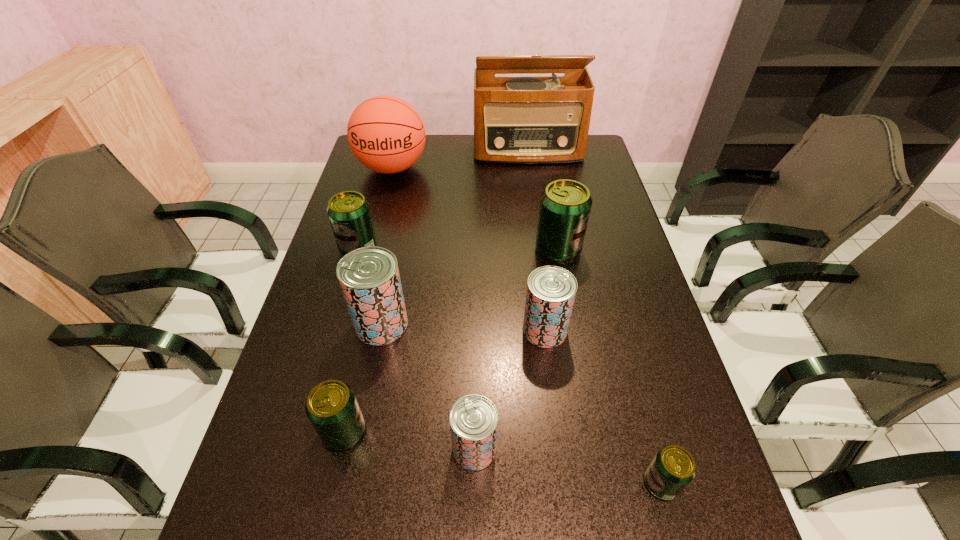
This screenshot has height=540, width=960. Identify the location of empty space between the third biggest green beer can and the shortest beer can. (503, 457).

This screenshot has width=960, height=540. What are the coordinates of `free space between the leftmost red beer can and the biggest green beer can` in the screenshot? It's located at (469, 287).

Locate an element on the screen. This screenshot has width=960, height=540. free space between the smallest red beer can and the third biggest green beer can is located at coordinates (409, 440).

Where is `free spot between the rightmost red beer can and the third biggest green beer can`? This screenshot has height=540, width=960. free spot between the rightmost red beer can and the third biggest green beer can is located at coordinates (444, 381).

The height and width of the screenshot is (540, 960). Find the location of `blank region between the rightmost beer can and the radio receiver`. blank region between the rightmost beer can and the radio receiver is located at coordinates (594, 316).

Identify the location of object that stands as the fifth closest to the biggest red beer can. (565, 205).

Find the location of a particular element. The image size is (960, 540). object that stands as the sixth closest to the nearest red beer can is located at coordinates pyautogui.click(x=349, y=213).

You are a GUI agent. You are given a task and a screenshot of the screen. Output one action in this format:
    pyautogui.click(x=<x>, y=<y>)
    Task: Click on the beer can identified as the third closest to the second red beer can from right to left
    The width and height of the screenshot is (960, 540).
    Given the screenshot: What is the action you would take?
    pos(369,278)

Where is `the sixth closest beer can to the leftmost red beer can`? The width and height of the screenshot is (960, 540). the sixth closest beer can to the leftmost red beer can is located at coordinates (672, 469).

Locate an element on the screen. The width and height of the screenshot is (960, 540). green beer can that can be found as the third closest to the biggest green beer can is located at coordinates (332, 408).